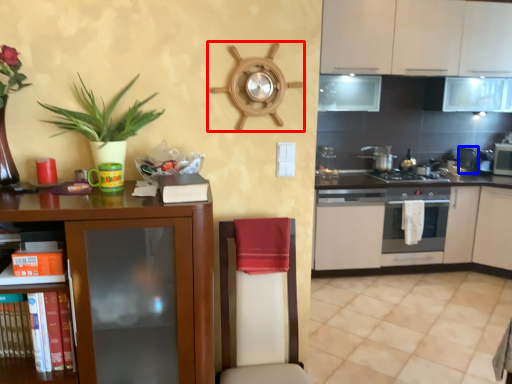
Question: Which object appears closest to the camera in this image, appliance (highlighted by a red box) or appliance (highlighted by a blue box)?

Choices:
 (A) appliance
 (B) appliance

Answer: (A)